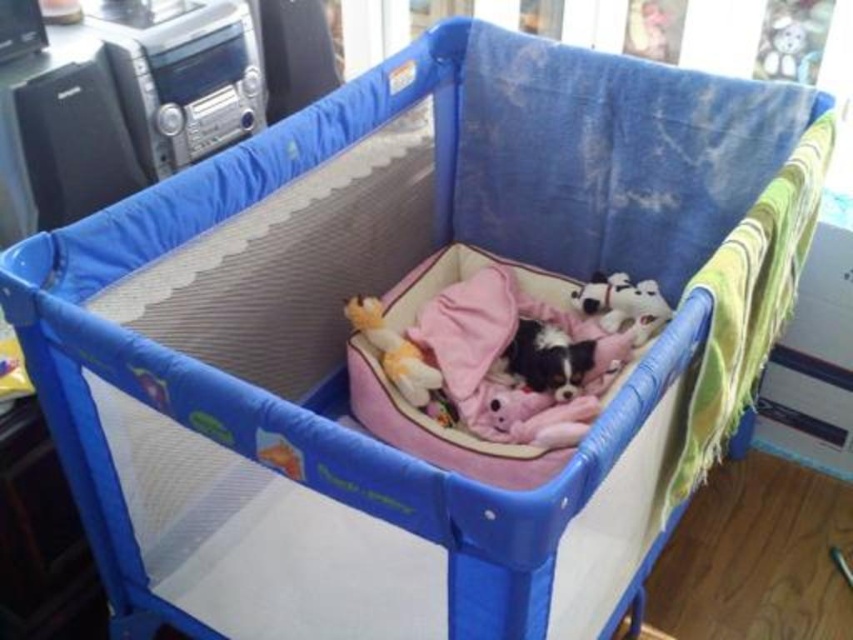
You are a parent trying to retrieve the white plush bear at upper right for your child. The playpen has a height of 1 meter. Can you safely reach the bear without climbing into the playpen?

The white plush bear at upper right is 1.50 meters away from the camera, so yes, you can safely reach it without climbing into the playpen since the distance is greater than the playpen height of 1 meter.

You are a parent trying to place a new toy in the baby playpen. The playpen already has the soft plush toy at center and the white plush dog at upper right. Which toy takes up more space in the playpen?

The white plush dog at upper right takes up more space in the playpen than the soft plush toy at center because the soft plush toy at center occupies less space than white plush dog at upper right.